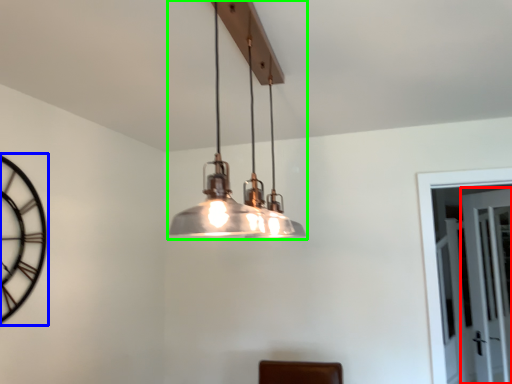
Question: Which object is the farthest from glass door (highlighted by a red box)? Choose among these: clock (highlighted by a blue box) or lamp (highlighted by a green box).

Choices:
 (A) clock
 (B) lamp

Answer: (A)